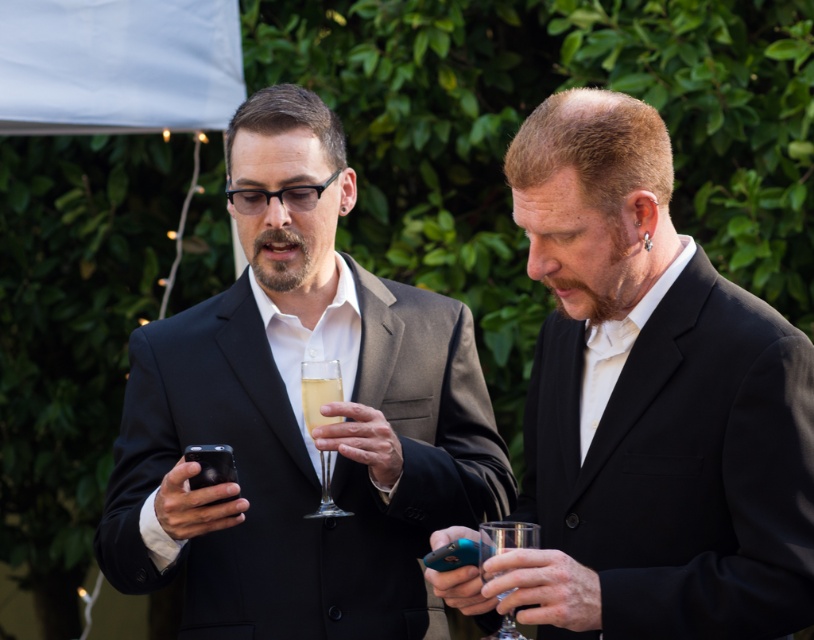
Does clear crystal wine glass at center have a greater height compared to clear glass champagne flute at center?

Yes, clear crystal wine glass at center is taller than clear glass champagne flute at center.

What do you see at coordinates (318, 390) in the screenshot? I see `clear crystal wine glass at center` at bounding box center [318, 390].

What are the coordinates of `clear crystal wine glass at center` in the screenshot? It's located at (318, 390).

Who is positioned more to the left, matte black suit at center or matte black suit at right?

matte black suit at center is more to the left.

Consider the image. Can you confirm if matte black suit at center is thinner than matte black suit at right?

No.

Is point (220, 563) less distant than point (545, 340)?

No, (220, 563) is behind (545, 340).

The width and height of the screenshot is (814, 640). I want to click on matte black suit at center, so click(x=300, y=417).

Does point (322, 488) lie behind point (482, 554)?

Yes.

Between point (305, 362) and point (505, 520), which one is positioned behind?

The point (305, 362) is more distant.

Does point (335, 360) lie in front of point (523, 636)?

No, it is behind (523, 636).

Where is `clear crystal wine glass at center`? clear crystal wine glass at center is located at coordinates (x=318, y=390).